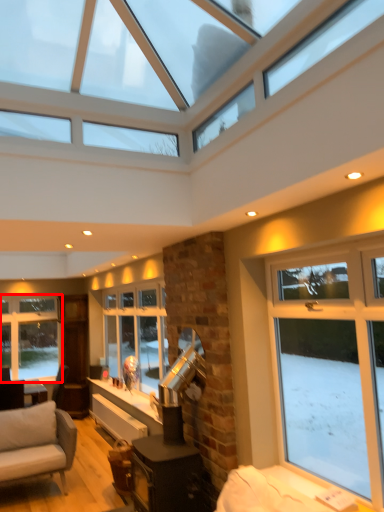
Question: Considering the relative positions of window (annotated by the red box) and window in the image provided, where is window (annotated by the red box) located with respect to the staircase?

Choices:
 (A) left
 (B) right

Answer: (A)